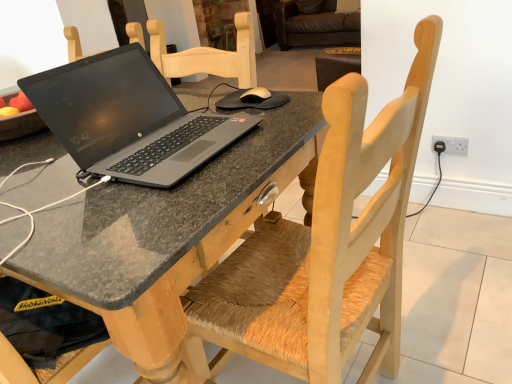
Question: Does white plastic electrical outlet at right have a greater height compared to wooden chair with woven seat at center?

Choices:
 (A) yes
 (B) no

Answer: (B)

Question: Does white plastic electrical outlet at right have a lesser width compared to wooden chair with woven seat at center?

Choices:
 (A) yes
 (B) no

Answer: (A)

Question: Is white plastic electrical outlet at right not inside wooden chair with woven seat at center?

Choices:
 (A) no
 (B) yes

Answer: (B)

Question: From a real-world perspective, is white plastic electrical outlet at right under wooden chair with woven seat at center?

Choices:
 (A) yes
 (B) no

Answer: (A)

Question: Is white plastic electrical outlet at right positioned far away from wooden chair with woven seat at center?

Choices:
 (A) no
 (B) yes

Answer: (B)

Question: Is wooden chair with woven seat at center in front of or behind granite table at center in the image?

Choices:
 (A) front
 (B) behind

Answer: (A)

Question: Visually, is wooden chair with woven seat at center positioned to the left or to the right of granite table at center?

Choices:
 (A) left
 (B) right

Answer: (B)

Question: Is wooden chair with woven seat at center bigger or smaller than granite table at center?

Choices:
 (A) big
 (B) small

Answer: (B)

Question: Is wooden chair with woven seat at center taller or shorter than granite table at center?

Choices:
 (A) short
 (B) tall

Answer: (B)

Question: From a real-world perspective, is white plastic electrical outlet at right positioned above or below matte black laptop at center?

Choices:
 (A) below
 (B) above

Answer: (A)

Question: Based on their sizes in the image, would you say white plastic electrical outlet at right is bigger or smaller than matte black laptop at center?

Choices:
 (A) small
 (B) big

Answer: (A)

Question: Do you think white plastic electrical outlet at right is within matte black laptop at center, or outside of it?

Choices:
 (A) inside
 (B) outside

Answer: (B)

Question: From the image's perspective, is white plastic electrical outlet at right located above or below matte black laptop at center?

Choices:
 (A) below
 (B) above

Answer: (A)

Question: Choose the correct answer: Is wooden chair with woven seat at center inside matte black laptop at center or outside it?

Choices:
 (A) inside
 (B) outside

Answer: (B)

Question: Visually, is wooden chair with woven seat at center positioned to the left or to the right of matte black laptop at center?

Choices:
 (A) right
 (B) left

Answer: (A)